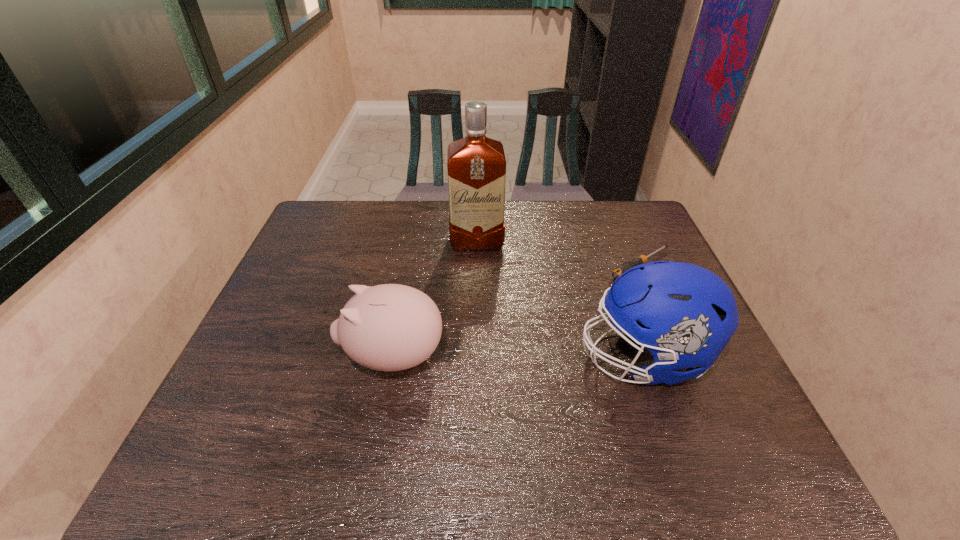
You are a GUI agent. You are given a task and a screenshot of the screen. Output one action in this format:
    pyautogui.click(x=<x>, y=<y>)
    Task: Click on the vacant space located on the front label of the liquor
    The image size is (960, 540).
    Given the screenshot: What is the action you would take?
    pyautogui.click(x=485, y=349)

Where is `blank space located 0.070m on the front label of the liquor`? This screenshot has width=960, height=540. blank space located 0.070m on the front label of the liquor is located at coordinates coord(479,268).

The width and height of the screenshot is (960, 540). What are the coordinates of `free space located 0.070m on the front label of the liquor` in the screenshot? It's located at (479, 268).

Image resolution: width=960 pixels, height=540 pixels. What are the coordinates of `vacant space located at the tip of the shortest object` in the screenshot? It's located at (561, 309).

Identify the location of vacant region located 0.140m at the tip of the shortest object. The image size is (960, 540). (584, 295).

Where is `vacant point located 0.150m at the tip of the shortest object`? The height and width of the screenshot is (540, 960). vacant point located 0.150m at the tip of the shortest object is located at coordinates (581, 297).

The width and height of the screenshot is (960, 540). What are the coordinates of `object that is at the far edge` in the screenshot? It's located at (476, 164).

The image size is (960, 540). I want to click on object situated at the near edge, so click(683, 314).

Locate an element on the screen. The image size is (960, 540). football helmet that is at the right edge is located at coordinates (683, 314).

At what (x,y) coordinates should I click in order to perform the action: click on screwdriver that is at the right edge. Please return your answer as a coordinate pair (x, y). Image resolution: width=960 pixels, height=540 pixels. Looking at the image, I should click on (642, 259).